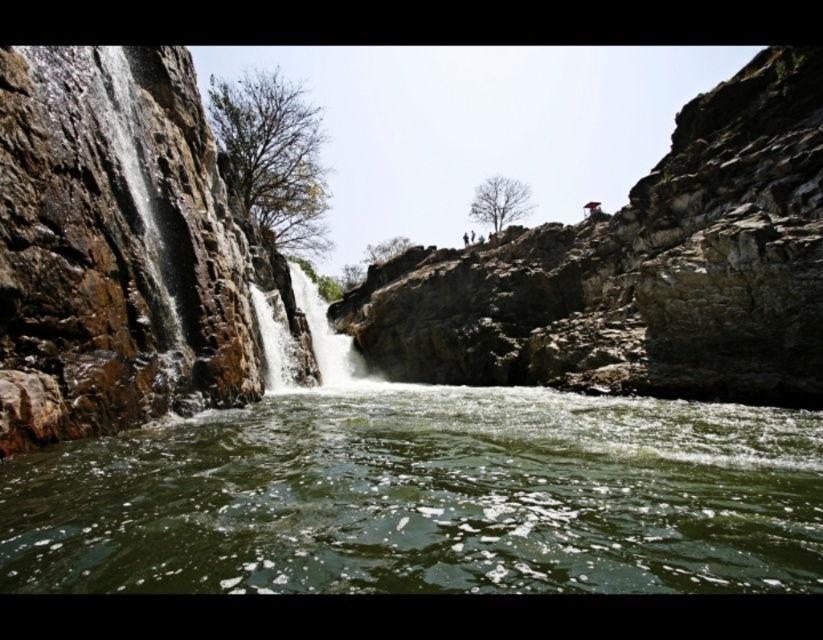
Which is more to the left, brown rough rock face at left or translucent white water at center?

Positioned to the left is brown rough rock face at left.

Does brown rough rock face at left have a lesser width compared to translucent white water at center?

Indeed, brown rough rock face at left has a lesser width compared to translucent white water at center.

Which is in front, point (54, 305) or point (331, 339)?

Point (54, 305) is more forward.

Find the location of `brown rough rock face at left`. brown rough rock face at left is located at coordinates (124, 250).

Can you confirm if brown rocky cliff at upper center is shorter than brown rough rock face at left?

No, brown rocky cliff at upper center is not shorter than brown rough rock face at left.

Who is more forward, (450, 301) or (26, 179)?

Positioned in front is point (26, 179).

Does point (751, 240) lie in front of point (171, 275)?

No.

Identify the location of brown rocky cliff at upper center. This screenshot has width=823, height=640. (639, 269).

Which of these two, green smooth river at center or brown rocky cliff at upper center, stands shorter?

green smooth river at center

Is green smooth river at center wider than brown rocky cliff at upper center?

No, green smooth river at center is not wider than brown rocky cliff at upper center.

Is point (747, 504) positioned before point (649, 356)?

Yes, it is.

You are a GUI agent. You are given a task and a screenshot of the screen. Output one action in this format:
    pyautogui.click(x=<x>, y=<y>)
    Task: Click on the green smooth river at center
    
    Given the screenshot: What is the action you would take?
    pyautogui.click(x=425, y=497)